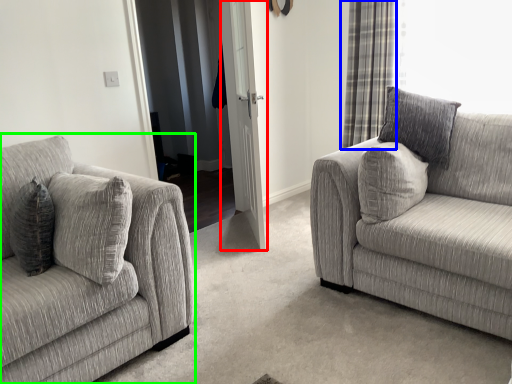
Question: Which is farther away from screen door (highlighted by a red box)? curtain (highlighted by a blue box) or studio couch (highlighted by a green box)?

Choices:
 (A) curtain
 (B) studio couch

Answer: (B)